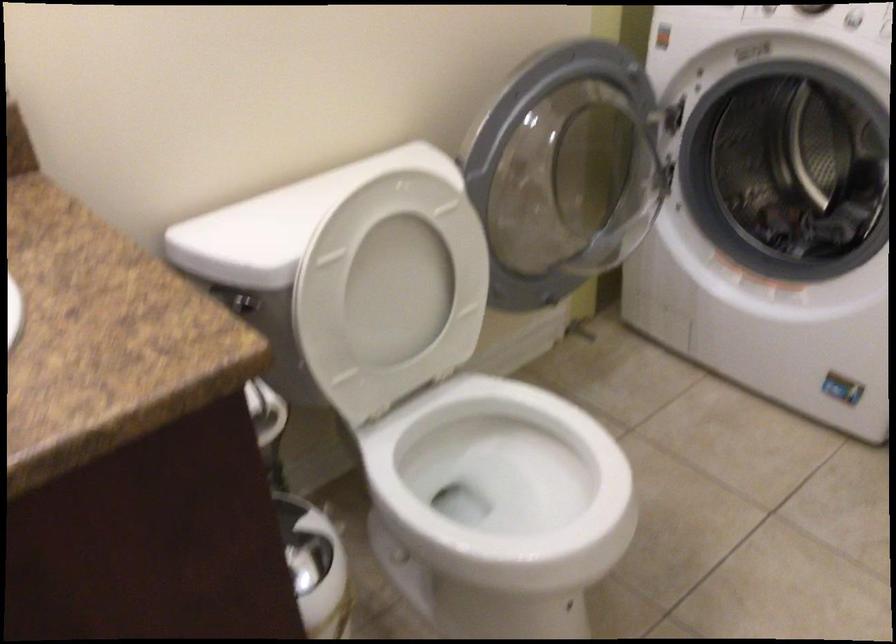
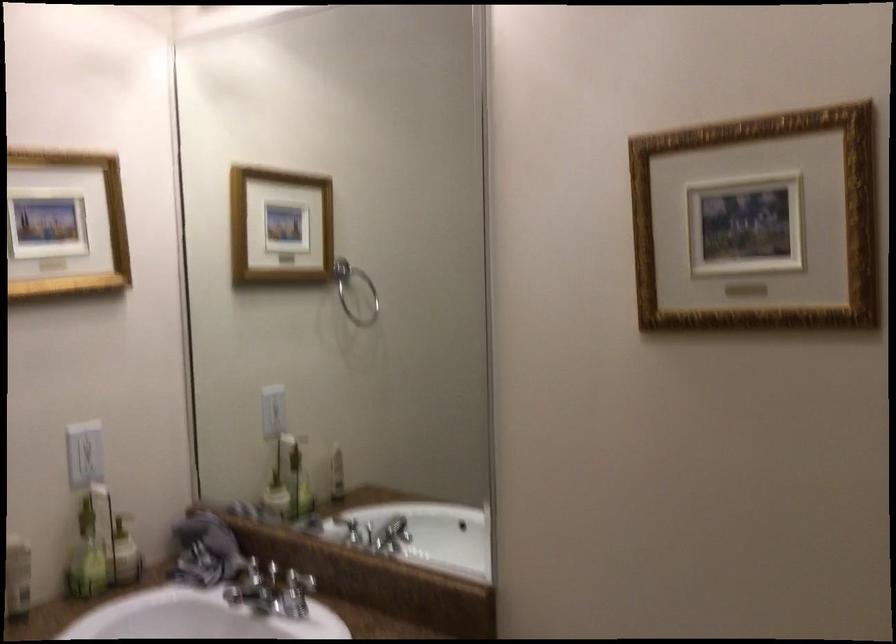
Question: The camera is either moving clockwise (left) or counter-clockwise (right) around the object. The first image is from the beginning of the video and the second image is from the end. Is the camera moving left or right when shooting the video?

Choices:
 (A) Left
 (B) Right

Answer: (B)